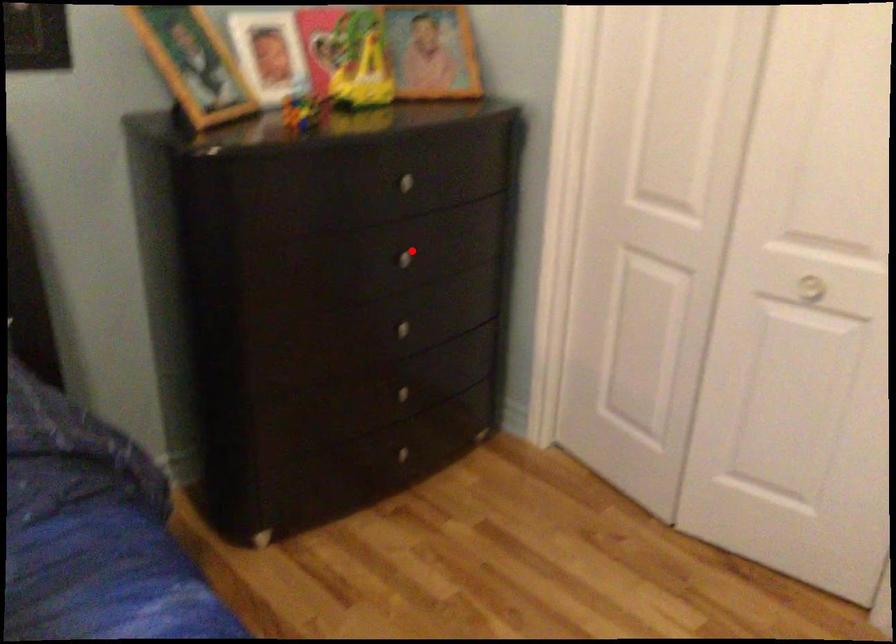
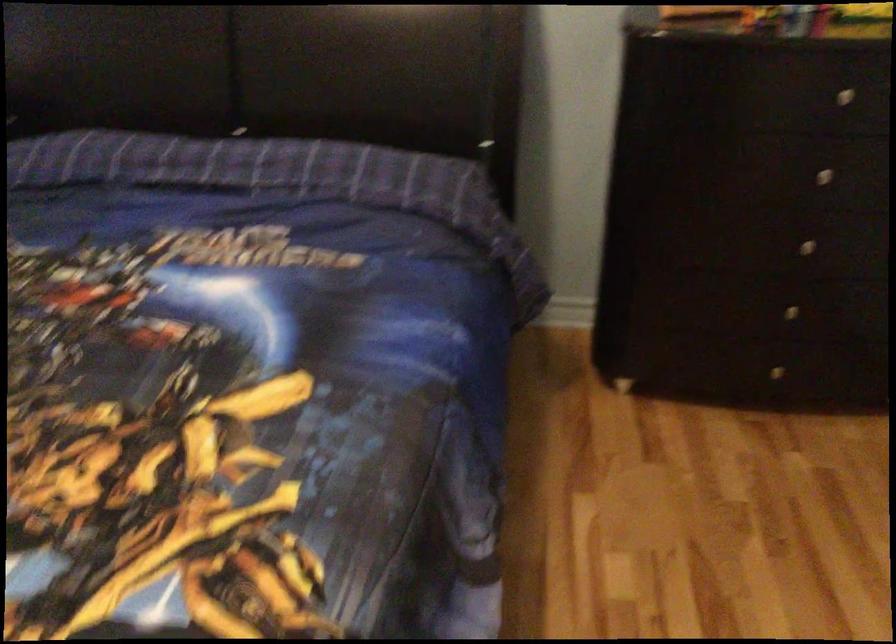
The point at the highlighted location is marked in the first image. Where is the corresponding point in the second image?

(833, 169)